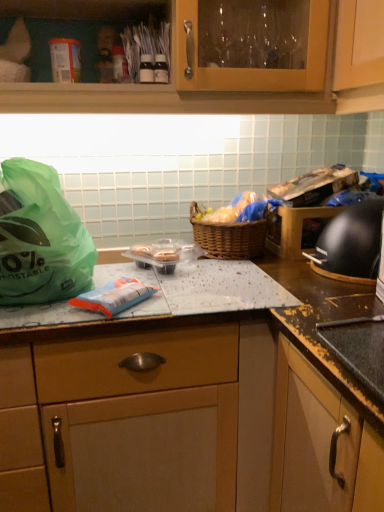
Question: Can you confirm if black granite countertop at center is positioned to the right of woven brown picnic basket at center?

Choices:
 (A) no
 (B) yes

Answer: (A)

Question: Considering the relative sizes of black granite countertop at center and woven brown picnic basket at center in the image provided, is black granite countertop at center bigger than woven brown picnic basket at center?

Choices:
 (A) no
 (B) yes

Answer: (B)

Question: Considering the relative sizes of black granite countertop at center and woven brown picnic basket at center in the image provided, is black granite countertop at center smaller than woven brown picnic basket at center?

Choices:
 (A) no
 (B) yes

Answer: (A)

Question: Is black granite countertop at center beside woven brown picnic basket at center?

Choices:
 (A) no
 (B) yes

Answer: (A)

Question: Is black granite countertop at center behind woven brown picnic basket at center?

Choices:
 (A) no
 (B) yes

Answer: (A)

Question: Does black granite countertop at center appear on the left side of woven brown picnic basket at center?

Choices:
 (A) yes
 (B) no

Answer: (A)

Question: Is black granite countertop at center closer to camera compared to black matte gas stove at right?

Choices:
 (A) no
 (B) yes

Answer: (B)

Question: Is black granite countertop at center in contact with black matte gas stove at right?

Choices:
 (A) yes
 (B) no

Answer: (B)

Question: From a real-world perspective, is black granite countertop at center below black matte gas stove at right?

Choices:
 (A) yes
 (B) no

Answer: (A)

Question: Is black granite countertop at center at the left side of black matte gas stove at right?

Choices:
 (A) yes
 (B) no

Answer: (A)

Question: Is black granite countertop at center behind black matte gas stove at right?

Choices:
 (A) yes
 (B) no

Answer: (B)

Question: Can you confirm if black granite countertop at center is shorter than black matte gas stove at right?

Choices:
 (A) no
 (B) yes

Answer: (A)

Question: Can you confirm if white cardboard canister at upper left is smaller than green plastic bag at left?

Choices:
 (A) no
 (B) yes

Answer: (B)